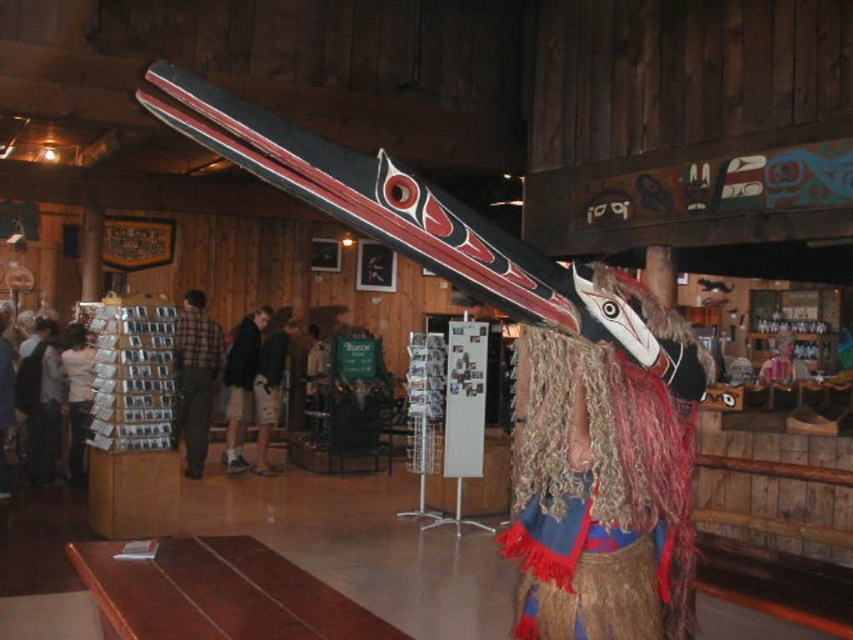
Is carved wooden mask at center to the right of plaid fabric shirt at left from the viewer's perspective?

Correct, you'll find carved wooden mask at center to the right of plaid fabric shirt at left.

Between carved wooden mask at center and plaid fabric shirt at left, which one is positioned lower?

plaid fabric shirt at left is below.

Find the location of `carved wooden mask at center`. carved wooden mask at center is located at coordinates (607, 477).

Locate an element on the screen. This screenshot has width=853, height=640. carved wooden mask at center is located at coordinates (607, 477).

Does carved wooden mask at center appear over white paper stack at left?

Correct, carved wooden mask at center is located above white paper stack at left.

Is point (653, 397) positioned before point (86, 340)?

Yes, it is in front of point (86, 340).

The image size is (853, 640). I want to click on carved wooden mask at center, so tap(607, 477).

Can you confirm if dark blue jacket at center is shorter than white paper stack at left?

No, dark blue jacket at center is not shorter than white paper stack at left.

Is dark blue jacket at center wider than white paper stack at left?

Indeed, dark blue jacket at center has a greater width compared to white paper stack at left.

Who is more forward, (225, 460) or (76, 480)?

Positioned in front is point (76, 480).

Locate an element on the screen. dark blue jacket at center is located at coordinates (241, 381).